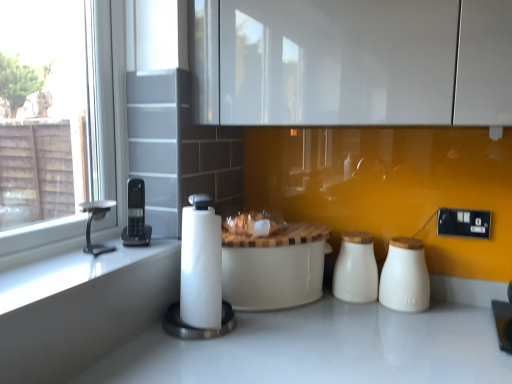
Question: Is black plastic phone at left, the 1th appliance positioned from the left, aimed at white paper towel at center, the first appliance viewed from the right?

Choices:
 (A) yes
 (B) no

Answer: (A)

Question: Is black plastic phone at left, which is the 2th appliance from right to left, behind white paper towel at center, the 2th appliance when ordered from left to right?

Choices:
 (A) no
 (B) yes

Answer: (B)

Question: Can you confirm if black plastic phone at left, which is the 2th appliance from right to left, is positioned to the right of white paper towel at center, the 2th appliance when ordered from left to right?

Choices:
 (A) yes
 (B) no

Answer: (B)

Question: Is the depth of black plastic phone at left, which is the 2th appliance from right to left, less than that of white paper towel at center, the first appliance viewed from the right?

Choices:
 (A) no
 (B) yes

Answer: (A)

Question: From a real-world perspective, does black plastic phone at left, which is the 2th appliance from right to left, sit lower than white paper towel at center, the first appliance viewed from the right?

Choices:
 (A) no
 (B) yes

Answer: (A)

Question: Is white ceramic salt shaker at center, the 2th salt shaker when ordered from right to left, situated inside black plastic phone at left, the 1th appliance positioned from the left, or outside?

Choices:
 (A) inside
 (B) outside

Answer: (B)

Question: Is white ceramic salt shaker at center, marked as the first salt shaker in a left-to-right arrangement, taller or shorter than black plastic phone at left, which is the 2th appliance from right to left?

Choices:
 (A) short
 (B) tall

Answer: (B)

Question: Is white ceramic salt shaker at center, the 2th salt shaker when ordered from right to left, bigger or smaller than black plastic phone at left, the 1th appliance positioned from the left?

Choices:
 (A) big
 (B) small

Answer: (A)

Question: Looking at their shapes, would you say white ceramic salt shaker at center, the 2th salt shaker when ordered from right to left, is wider or thinner than black plastic phone at left, the 1th appliance positioned from the left?

Choices:
 (A) thin
 (B) wide

Answer: (B)

Question: Is silver metallic faucet at left bigger or smaller than white ceramic table at center?

Choices:
 (A) big
 (B) small

Answer: (B)

Question: Considering the positions of point (97, 251) and point (316, 240), is point (97, 251) closer or farther from the camera than point (316, 240)?

Choices:
 (A) farther
 (B) closer

Answer: (B)

Question: Is silver metallic faucet at left in front of or behind white ceramic table at center in the image?

Choices:
 (A) behind
 (B) front

Answer: (B)

Question: Is silver metallic faucet at left wider or thinner than white ceramic table at center?

Choices:
 (A) wide
 (B) thin

Answer: (B)

Question: Relative to white paper towel at center, the 2th appliance when ordered from left to right, is translucent plastic bag at center in front or behind?

Choices:
 (A) front
 (B) behind

Answer: (B)

Question: From a real-world perspective, is translucent plastic bag at center physically located above or below white paper towel at center, the 2th appliance when ordered from left to right?

Choices:
 (A) above
 (B) below

Answer: (A)